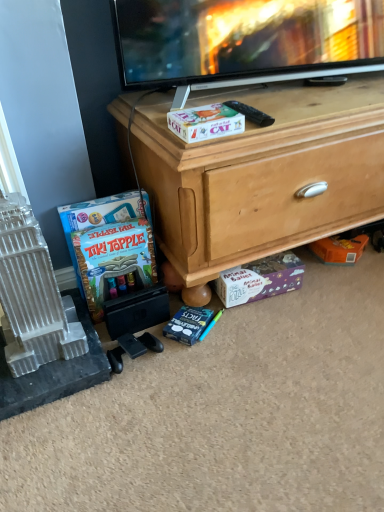
In order to click on empty space that is ontop of purple cardboard puzzle box at lower center (from a real-world perspective) in this screenshot , I will do `click(259, 267)`.